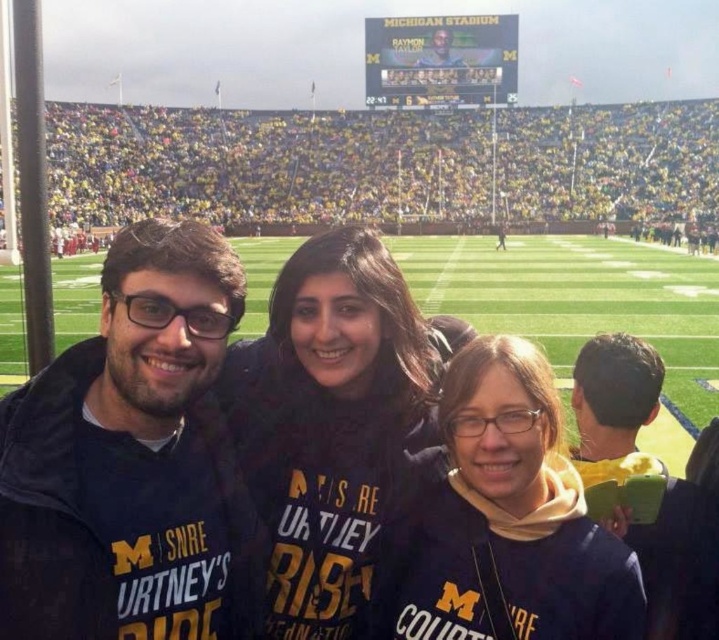
Question: Considering the relative positions of dark blue fabric at center and dark blue jacket at right in the image provided, where is dark blue fabric at center located with respect to dark blue jacket at right?

Choices:
 (A) right
 (B) left

Answer: (B)

Question: Which of the following is the farthest from the observer?

Choices:
 (A) dark blue jacket at right
 (B) dark blue fabric at center

Answer: (A)

Question: Which point is closer to the camera?

Choices:
 (A) dark blue fabric at center
 (B) dark blue jacket at right

Answer: (A)

Question: Is dark blue fabric at center closer to camera compared to dark blue jacket at right?

Choices:
 (A) yes
 (B) no

Answer: (A)

Question: Can you confirm if dark blue fabric at center is positioned to the left of dark blue jacket at right?

Choices:
 (A) no
 (B) yes

Answer: (B)

Question: Which object is farther from the camera taking this photo?

Choices:
 (A) dark blue fabric at center
 (B) dark blue jacket at right

Answer: (B)